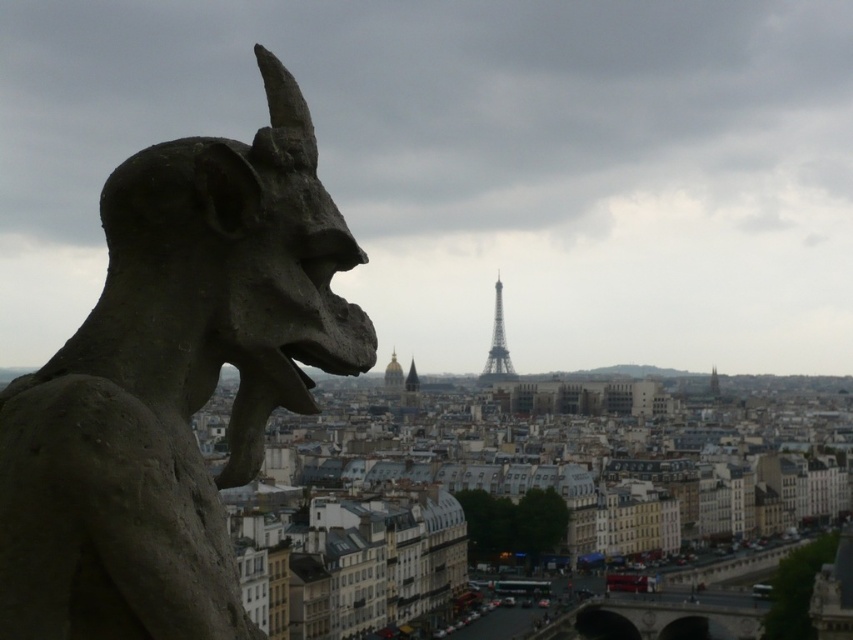
Question: Which of the following is the farthest from the observer?

Choices:
 (A) (508, 360)
 (B) (408, 380)

Answer: (A)

Question: Which of the following is the farthest from the observer?

Choices:
 (A) gold dome at center
 (B) golden dome at center

Answer: (A)

Question: Can you confirm if dark gray stone gargoyle at left is thinner than golden metallic eiffel tower at center?

Choices:
 (A) yes
 (B) no

Answer: (A)

Question: Which of the following is the closest to the observer?

Choices:
 (A) golden dome at center
 (B) golden metallic eiffel tower at center

Answer: (A)

Question: Does gold dome at center have a lesser width compared to golden dome at center?

Choices:
 (A) yes
 (B) no

Answer: (B)

Question: Can you confirm if golden metallic eiffel tower at center is positioned below golden dome at center?

Choices:
 (A) no
 (B) yes

Answer: (A)